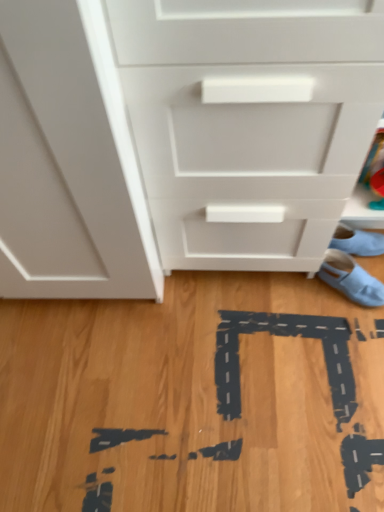
I want to click on free space in front of white matte chest of drawers at center, so click(253, 354).